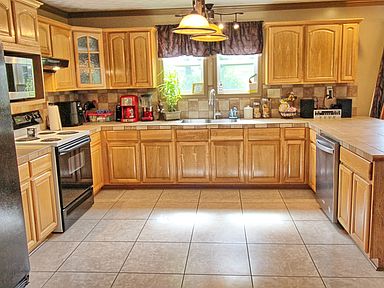
I want to click on microwave, so click(x=15, y=74).